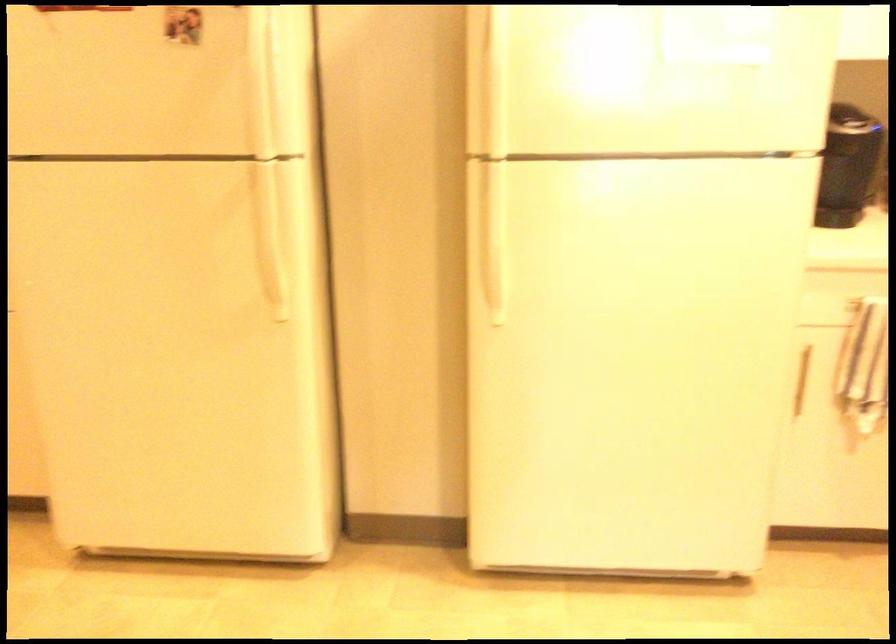
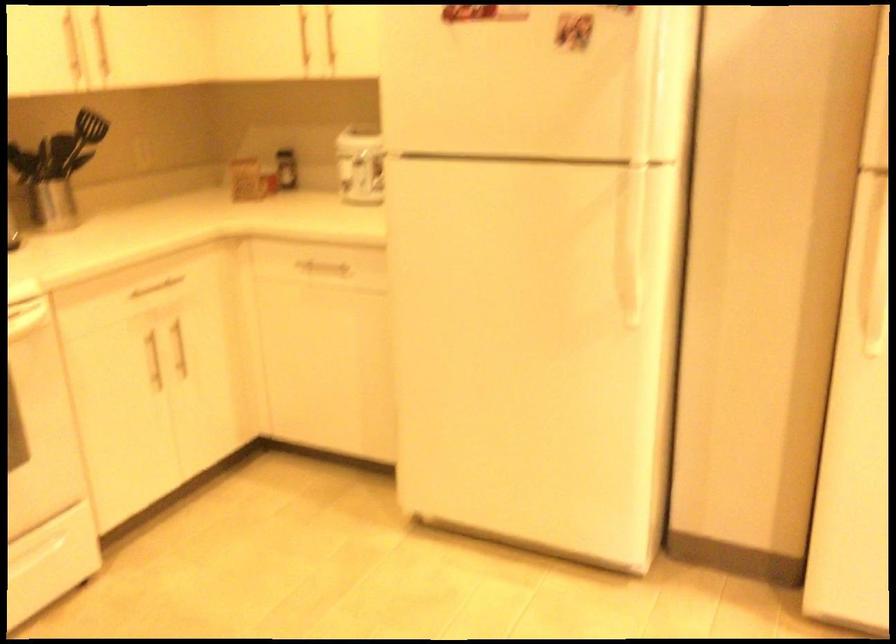
The point at [280,270] is marked in the first image. Where is the corresponding point in the second image?

(634, 277)